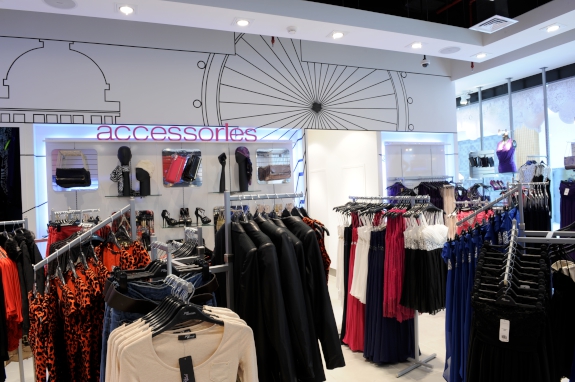
The image size is (575, 382). Identify the location of mannequin. (122, 169), (250, 164), (501, 153).